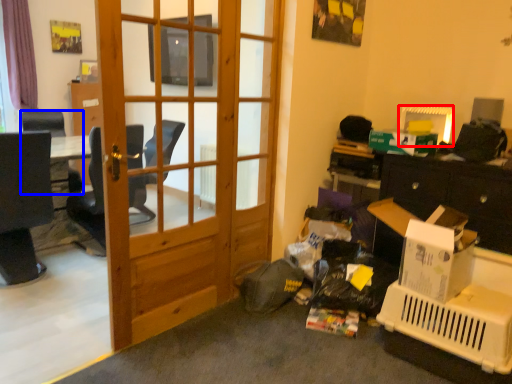
Question: Which of the following is the closest to the observer, picture frame (highlighted by a red box) or chair (highlighted by a blue box)?

Choices:
 (A) picture frame
 (B) chair

Answer: (A)